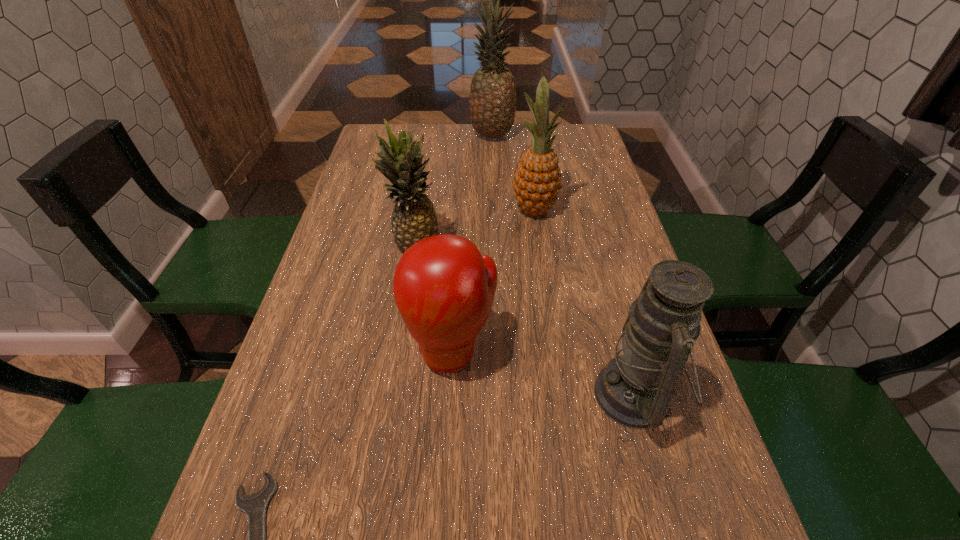
This screenshot has width=960, height=540. What are the coordinates of `free space between the farthest object and the leftmost pineapple` in the screenshot? It's located at tap(453, 192).

Find the location of `vacant area that lies between the oil lamp and the second farthest object`. vacant area that lies between the oil lamp and the second farthest object is located at coordinates (585, 302).

In order to click on vacant space that is in between the oil lamp and the boxing glove in this screenshot , I will do `click(543, 373)`.

Identify the location of vacant area that lies between the nearest pineapple and the oil lamp. (525, 321).

The width and height of the screenshot is (960, 540). Identify the location of object that ranks as the closest to the boxing glove. (413, 218).

Identify which object is the closest to the second farthest pineapple. Please provide its 2D coordinates. Your answer should be formatted as a tuple, i.e. [(x, y)], where the tuple contains the x and y coordinates of a point satisfying the conditions above.

[(413, 218)]

Identify which pineapple is located as the second nearest to the leftmost pineapple. Please provide its 2D coordinates. Your answer should be formatted as a tuple, i.e. [(x, y)], where the tuple contains the x and y coordinates of a point satisfying the conditions above.

[(492, 104)]

At what (x,y) coordinates should I click in order to perform the action: click on pineapple that stands as the closest to the second farthest object. Please return your answer as a coordinate pair (x, y). This screenshot has width=960, height=540. Looking at the image, I should click on (x=413, y=218).

The width and height of the screenshot is (960, 540). What are the coordinates of `blank area in the image that satisfies the following two spatial constraints: 1. on the striking surface of the boxing glove; 2. on the left side of the oil lamp` in the screenshot? It's located at (449, 395).